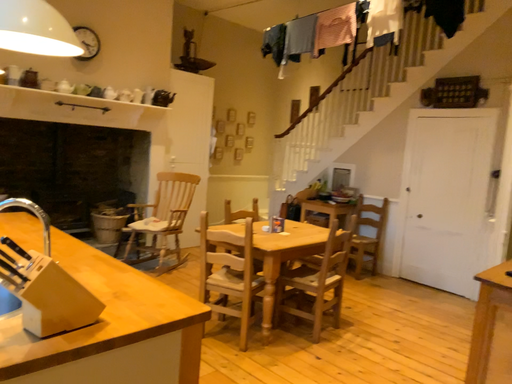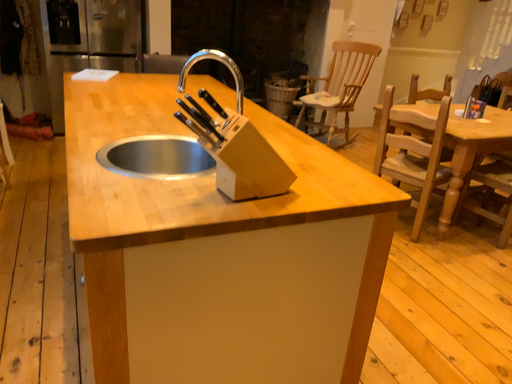
Question: Which way did the camera rotate in the video?

Choices:
 (A) rotated right
 (B) rotated left

Answer: (B)